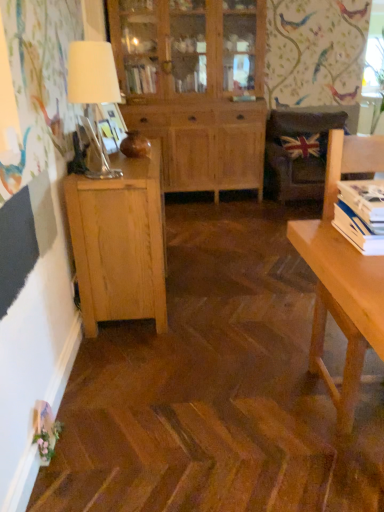
Question: Is natural wood cabinet at left, which is the second cabinetry in back-to-front order, thinner than brown leather chair at center?

Choices:
 (A) no
 (B) yes

Answer: (B)

Question: Is the position of natural wood cabinet at left, which is the second cabinetry in back-to-front order, more distant than that of brown leather chair at center?

Choices:
 (A) yes
 (B) no

Answer: (B)

Question: Can we say natural wood cabinet at left, which appears as the first cabinetry when viewed from the front, lies outside brown leather chair at center?

Choices:
 (A) no
 (B) yes

Answer: (B)

Question: Is natural wood cabinet at left, which appears as the first cabinetry when ordered from the bottom, aimed at brown leather chair at center?

Choices:
 (A) no
 (B) yes

Answer: (A)

Question: From a real-world perspective, is natural wood cabinet at left, which is the second cabinetry in back-to-front order, located higher than brown leather chair at center?

Choices:
 (A) yes
 (B) no

Answer: (B)

Question: Can you confirm if natural wood cabinet at left, which appears as the first cabinetry when viewed from the front, is positioned to the left of brown leather chair at center?

Choices:
 (A) no
 (B) yes

Answer: (B)

Question: Does light brown wooden desk at right come in front of union jack fabric pillow at upper right?

Choices:
 (A) no
 (B) yes

Answer: (B)

Question: Is light brown wooden desk at right wider than union jack fabric pillow at upper right?

Choices:
 (A) no
 (B) yes

Answer: (B)

Question: Can you confirm if light brown wooden desk at right is thinner than union jack fabric pillow at upper right?

Choices:
 (A) yes
 (B) no

Answer: (B)

Question: Would you consider light brown wooden desk at right to be distant from union jack fabric pillow at upper right?

Choices:
 (A) no
 (B) yes

Answer: (B)

Question: From the image's perspective, is light brown wooden desk at right on top of union jack fabric pillow at upper right?

Choices:
 (A) no
 (B) yes

Answer: (A)

Question: Would you say light brown wooden desk at right is outside union jack fabric pillow at upper right?

Choices:
 (A) yes
 (B) no

Answer: (A)

Question: Is natural wood cabinet at center, which is counted as the second cabinetry, starting from the front, completely or partially outside of white paper stack at right?

Choices:
 (A) yes
 (B) no

Answer: (A)